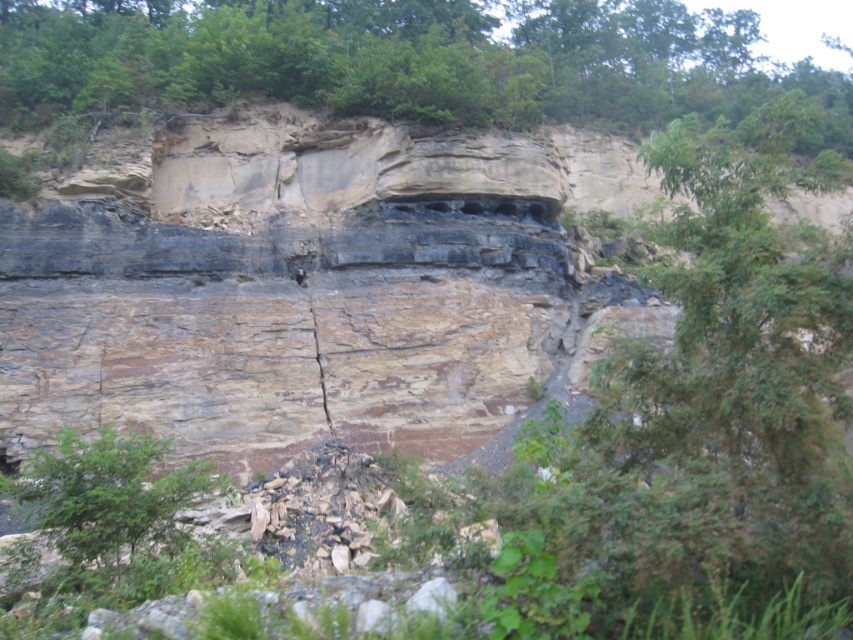
Between green leafy tree at upper center and green leafy tree at lower left, which one appears on the right side from the viewer's perspective?

Positioned to the right is green leafy tree at upper center.

Describe the element at coordinates (403, 60) in the screenshot. I see `green leafy tree at upper center` at that location.

Which is in front, point (372, 76) or point (142, 500)?

Point (142, 500) is in front.

Where is `green leafy tree at upper center`? green leafy tree at upper center is located at coordinates (403, 60).